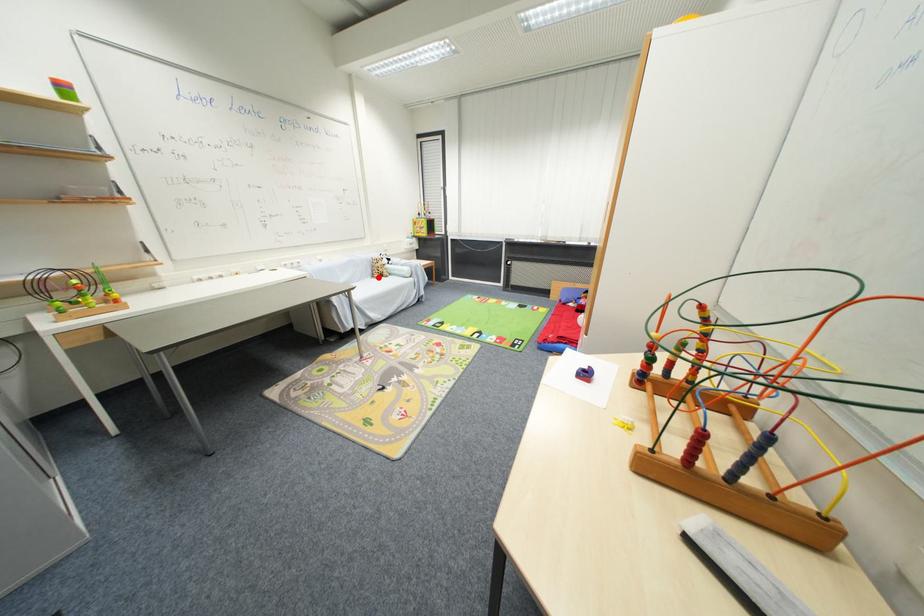
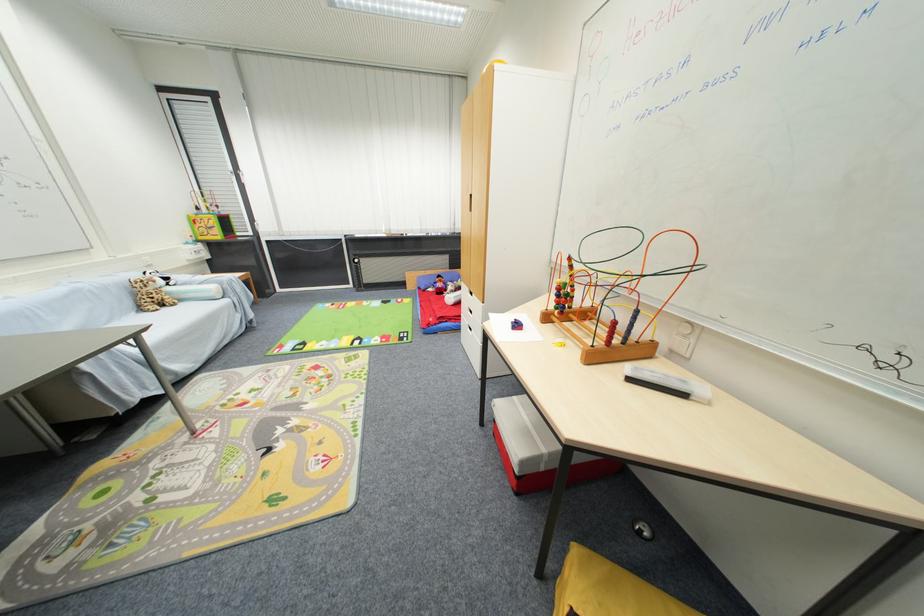
In the second image, find the point that corresponds to the highlighted location in the first image.

(146, 310)